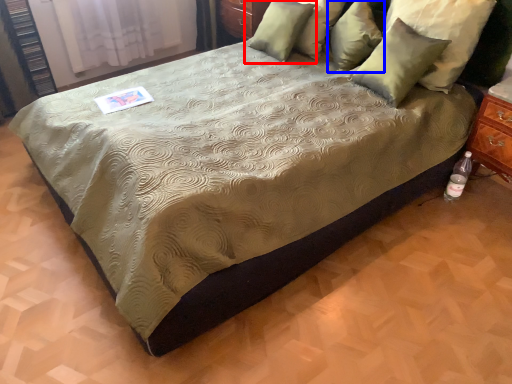
Question: Which of the following is the closest to the observer, pillow (highlighted by a red box) or pillow (highlighted by a blue box)?

Choices:
 (A) pillow
 (B) pillow

Answer: (B)